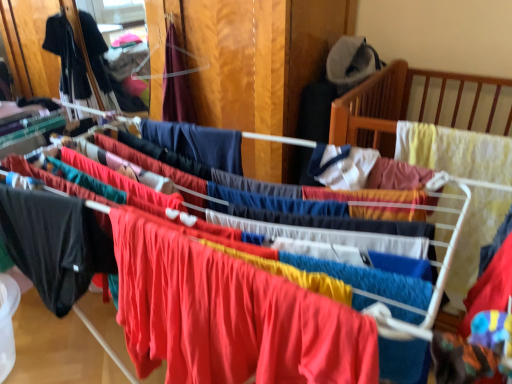
Question: Which direction should I rotate to face matte red fabric at center, positioned as the 4th clothing in back-to-front order, — up or down?

Choices:
 (A) up
 (B) down

Answer: (B)

Question: Is matte red fabric at center, the 1th clothing viewed from the front, with black fabric shirt at left, which is the 4th clothing in right-to-left order?

Choices:
 (A) no
 (B) yes

Answer: (A)

Question: Is matte red fabric at center, which is counted as the fourth clothing, starting from the left, surrounding black fabric shirt at left, the fourth clothing in the front-to-back sequence?

Choices:
 (A) no
 (B) yes

Answer: (A)

Question: Does matte red fabric at center, the 1th clothing viewed from the front, have a lesser width compared to black fabric shirt at left, the fourth clothing in the front-to-back sequence?

Choices:
 (A) no
 (B) yes

Answer: (B)

Question: Is matte red fabric at center, the 1th clothing in the right-to-left sequence, not close to black fabric shirt at left, which is the 4th clothing in right-to-left order?

Choices:
 (A) yes
 (B) no

Answer: (A)

Question: From a real-world perspective, is matte red fabric at center, positioned as the 4th clothing in back-to-front order, positioned under black fabric shirt at left, marked as the first clothing in a left-to-right arrangement, based on gravity?

Choices:
 (A) yes
 (B) no

Answer: (A)

Question: Considering the relative positions of matte red fabric at center, which is counted as the fourth clothing, starting from the left, and black fabric shirt at left, marked as the first clothing in a left-to-right arrangement, in the image provided, is matte red fabric at center, which is counted as the fourth clothing, starting from the left, to the left of black fabric shirt at left, marked as the first clothing in a left-to-right arrangement, from the viewer's perspective?

Choices:
 (A) yes
 (B) no

Answer: (B)

Question: From a real-world perspective, is black matte pants at left, the 2th clothing viewed from the left, positioned under velvet burgundy dress at upper center, the 2th clothing in the right-to-left sequence, based on gravity?

Choices:
 (A) no
 (B) yes

Answer: (B)

Question: Is the surface of black matte pants at left, the 2th clothing viewed from the left, in direct contact with velvet burgundy dress at upper center, the 2th clothing viewed from the back?

Choices:
 (A) no
 (B) yes

Answer: (A)

Question: Is black matte pants at left, acting as the 2th clothing starting from the front, shorter than velvet burgundy dress at upper center, placed as the 3th clothing when sorted from front to back?

Choices:
 (A) yes
 (B) no

Answer: (A)

Question: From a real-world perspective, is black matte pants at left, the 2th clothing viewed from the left, over velvet burgundy dress at upper center, the 2th clothing viewed from the back?

Choices:
 (A) yes
 (B) no

Answer: (B)

Question: Does black matte pants at left, the 2th clothing viewed from the left, come behind velvet burgundy dress at upper center, the 2th clothing viewed from the back?

Choices:
 (A) no
 (B) yes

Answer: (A)

Question: Considering the relative positions of black matte pants at left, the 3th clothing from the right, and velvet burgundy dress at upper center, the 2th clothing viewed from the back, in the image provided, is black matte pants at left, the 3th clothing from the right, to the left of velvet burgundy dress at upper center, the 2th clothing viewed from the back, from the viewer's perspective?

Choices:
 (A) no
 (B) yes

Answer: (B)

Question: Could you tell me if black matte pants at left, the 2th clothing viewed from the left, is turned towards black fabric shirt at left, marked as the first clothing in a left-to-right arrangement?

Choices:
 (A) no
 (B) yes

Answer: (A)